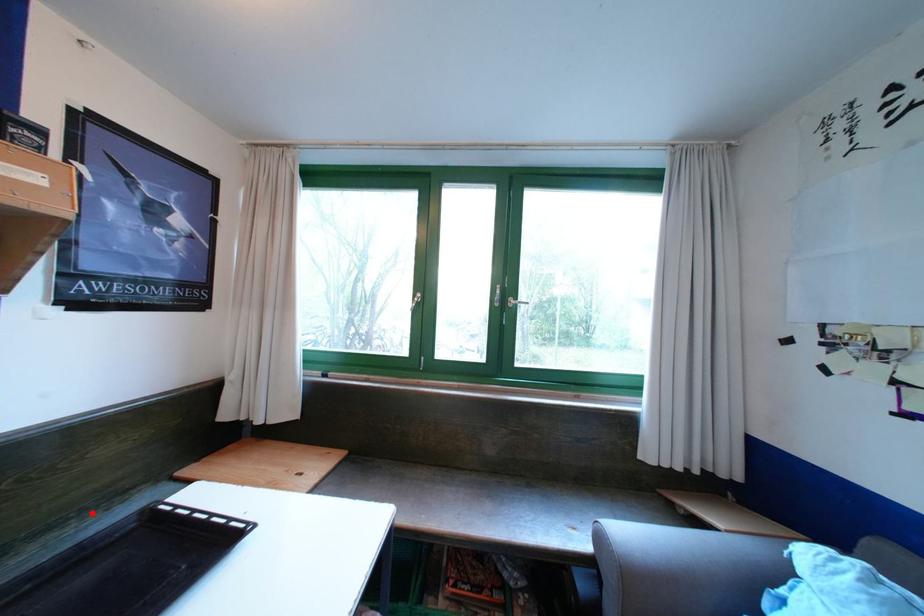
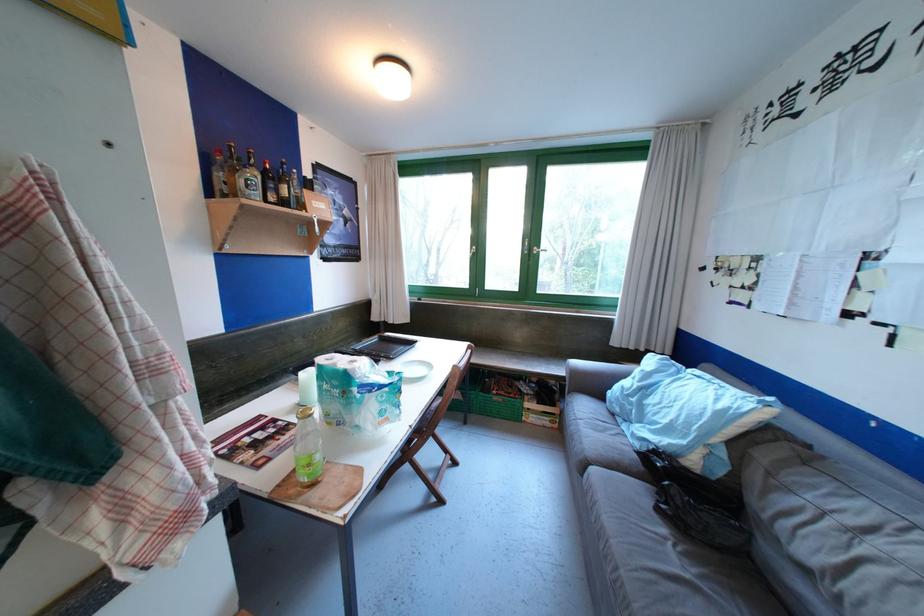
In the second image, find the point that corresponds to the highlighted location in the first image.

(348, 349)